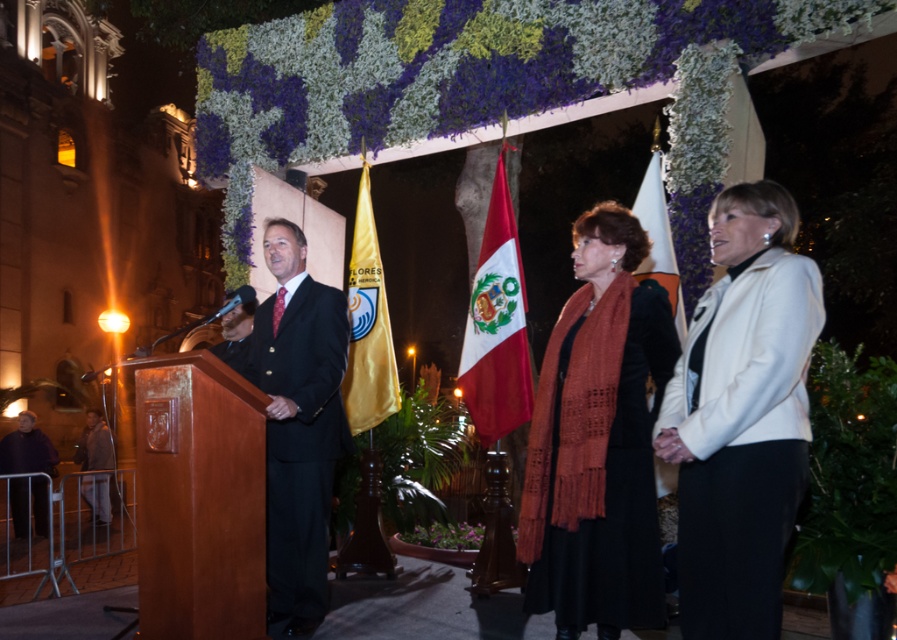
Question: In this image, where is white matte jacket at upper right located relative to dark blue fabric at lower left?

Choices:
 (A) above
 (B) below

Answer: (A)

Question: Which of the following is the closest to the observer?

Choices:
 (A) (672, 301)
 (B) (475, 292)

Answer: (A)

Question: Which is nearer to the knitted wool scarf at center?

Choices:
 (A) red fabric flag at center
 (B) white fabric flag at center

Answer: (B)

Question: Which point appears farthest from the camera in this image?

Choices:
 (A) (110, 444)
 (B) (494, 433)
 (C) (660, 218)
 (D) (248, 346)

Answer: (A)

Question: Does black satin suit at left appear over dark blue fabric at lower left?

Choices:
 (A) yes
 (B) no

Answer: (A)

Question: Does black satin suit at left appear on the right side of satin black suit at left?

Choices:
 (A) yes
 (B) no

Answer: (A)